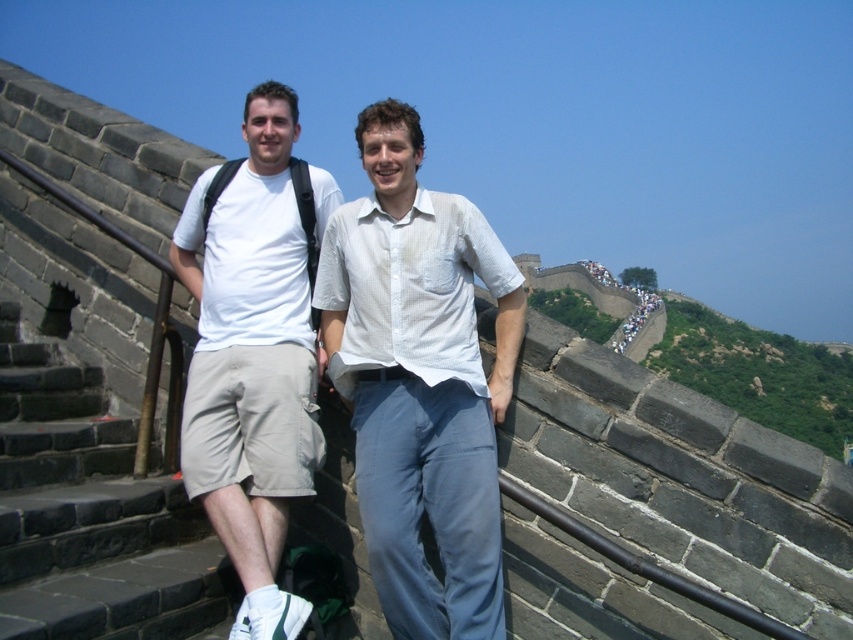
Question: Does white cotton shirt at center appear over black stone stairs at lower left?

Choices:
 (A) no
 (B) yes

Answer: (B)

Question: Is white cotton t-shirt at center to the right of black stone stairs at lower left from the viewer's perspective?

Choices:
 (A) no
 (B) yes

Answer: (B)

Question: Which point is closer to the camera?

Choices:
 (A) white cotton t-shirt at center
 (B) white cotton shirt at center

Answer: (B)

Question: In this image, where is white cotton shirt at center located relative to white cotton t-shirt at center?

Choices:
 (A) left
 (B) right

Answer: (B)

Question: Considering the real-world distances, which object is farthest from the white cotton t-shirt at center?

Choices:
 (A) white cotton shirt at center
 (B) black stone stairs at lower left

Answer: (B)

Question: Estimate the real-world distances between objects in this image. Which object is closer to the white cotton shirt at center?

Choices:
 (A) black stone stairs at lower left
 (B) white cotton t-shirt at center

Answer: (B)